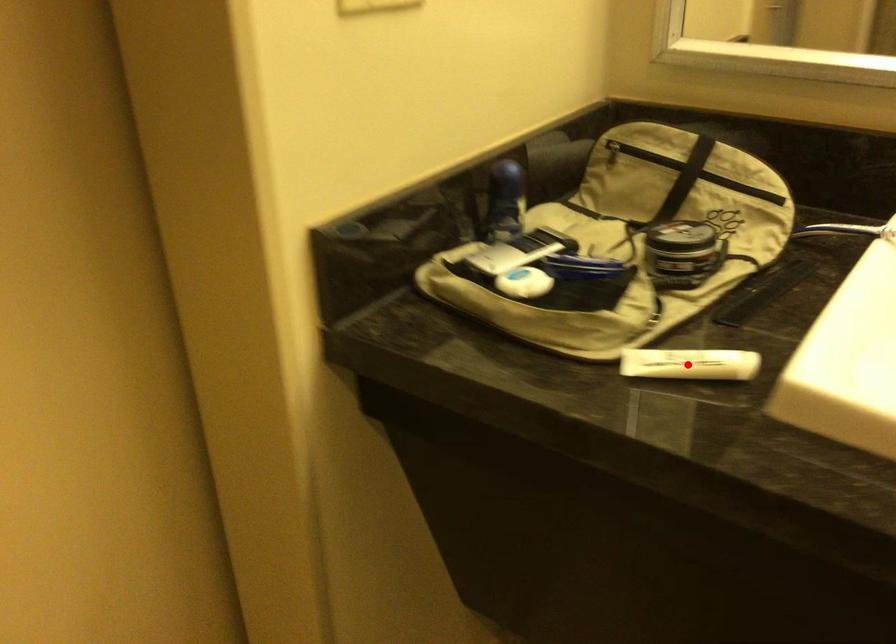
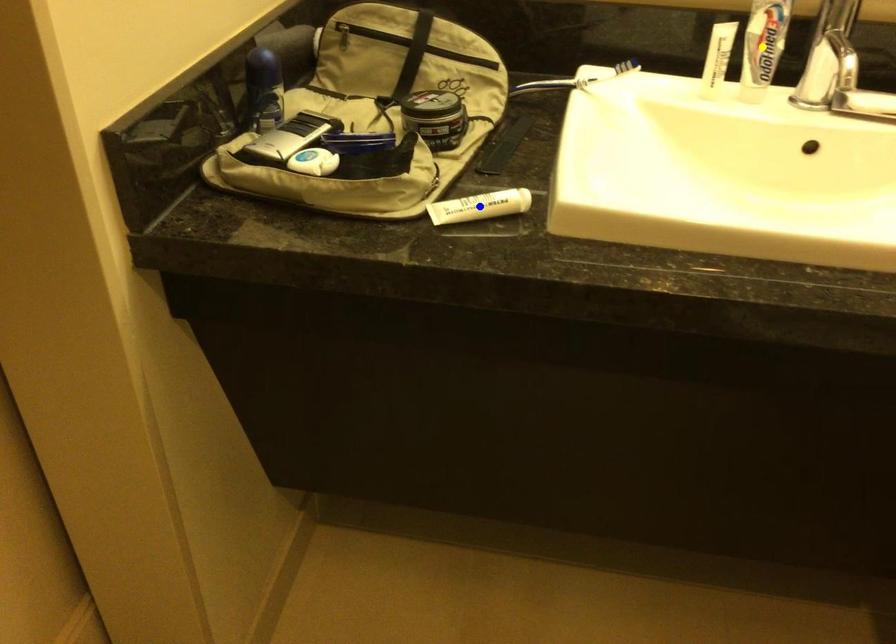
Question: I am providing you with two images of the same scene from different viewpoints. A red point is marked on the first image. You are given multiple points on the second image. Which point in image 2 represents the same 3d spot as the red point in image 1?

Choices:
 (A) green point
 (B) yellow point
 (C) blue point

Answer: (A)